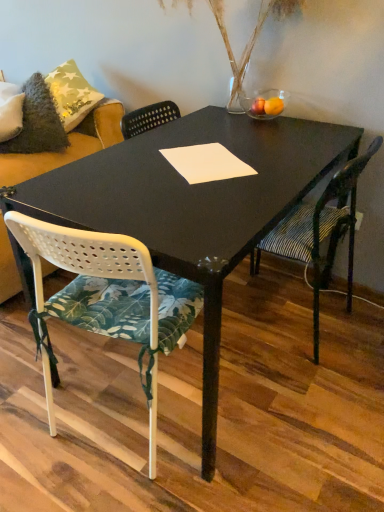
Locate an element on the screen. The image size is (384, 512). translucent glass vase at upper center is located at coordinates point(251,34).

Identify the location of striped fabric chair at right, the second chair when ordered from left to right. The image size is (384, 512). (321, 232).

What do you see at coordinates (206, 163) in the screenshot?
I see `white paper at center` at bounding box center [206, 163].

In order to face white perforated plastic chair at center, which is counted as the 2th chair, starting from the right, should I rotate leftwards or rightwards?

Rotate your view left by about 8.146°.

You are a GUI agent. You are given a task and a screenshot of the screen. Output one action in this format:
    pyautogui.click(x=<x>, y=<y>)
    Task: Click on the fuzzy gray pillow at upper left
    
    Given the screenshot: What is the action you would take?
    pyautogui.click(x=38, y=122)

Is fuzzy gray pillow at upper left at the back of white perforated plastic chair at center, which is counted as the 2th chair, starting from the right?

No, white perforated plastic chair at center, which is counted as the 2th chair, starting from the right, is not facing the opposite direction of fuzzy gray pillow at upper left.

Does white perforated plastic chair at center, which is the 1th chair from left to right, have a lesser width compared to fuzzy gray pillow at upper left?

In fact, white perforated plastic chair at center, which is the 1th chair from left to right, might be wider than fuzzy gray pillow at upper left.

Considering the sizes of white perforated plastic chair at center, which is counted as the 2th chair, starting from the right, and fuzzy gray pillow at upper left in the image, is white perforated plastic chair at center, which is counted as the 2th chair, starting from the right, bigger or smaller than fuzzy gray pillow at upper left?

Considering their sizes, white perforated plastic chair at center, which is counted as the 2th chair, starting from the right, takes up more space than fuzzy gray pillow at upper left.

From a real-world perspective, between white perforated plastic chair at center, which is the 1th chair from left to right, and fuzzy gray pillow at upper left, who is vertically higher?

fuzzy gray pillow at upper left.

Which of these two, white paper at center or striped fabric chair at right, which appears as the 1th chair when viewed from the right, stands shorter?

white paper at center is shorter.

Is white paper at center outside of striped fabric chair at right, the second chair when ordered from left to right?

Yes, white paper at center is not within striped fabric chair at right, the second chair when ordered from left to right.

Is white paper at center at the left side of striped fabric chair at right, the second chair when ordered from left to right?

Correct, you'll find white paper at center to the left of striped fabric chair at right, the second chair when ordered from left to right.

Which is nearer, (318, 334) or (188, 148)?

The point (188, 148) is more forward.

Is striped fabric chair at right, the second chair when ordered from left to right, in front of or behind white paper at center in the image?

striped fabric chair at right, the second chair when ordered from left to right, is positioned closer to the viewer than white paper at center.

Looking at this image, is striped fabric chair at right, the second chair when ordered from left to right, aimed at white paper at center?

No, striped fabric chair at right, the second chair when ordered from left to right, is not facing towards white paper at center.

How many degrees apart are the facing directions of translucent glass vase at upper center and fuzzy gray pillow at upper left?

There is a 29.1-degree angle between the facing directions of translucent glass vase at upper center and fuzzy gray pillow at upper left.

Can you see translucent glass vase at upper center touching fuzzy gray pillow at upper left?

No, translucent glass vase at upper center is not in contact with fuzzy gray pillow at upper left.

Considering the sizes of objects translucent glass vase at upper center and fuzzy gray pillow at upper left in the image provided, who is taller, translucent glass vase at upper center or fuzzy gray pillow at upper left?

With more height is translucent glass vase at upper center.

Considering the sizes of objects translucent glass vase at upper center and white perforated plastic chair at center, which is the 1th chair from left to right, in the image provided, who is smaller, translucent glass vase at upper center or white perforated plastic chair at center, which is the 1th chair from left to right,?

translucent glass vase at upper center.

Is translucent glass vase at upper center shorter than white perforated plastic chair at center, which is the 1th chair from left to right?

Correct, translucent glass vase at upper center is not as tall as white perforated plastic chair at center, which is the 1th chair from left to right.

Considering the positions of point (262, 1) and point (161, 332), is point (262, 1) closer or farther from the camera than point (161, 332)?

Point (262, 1) is farther from the camera than point (161, 332).

Is point (86, 310) positioned before point (223, 164)?

That is True.

How much distance is there between white perforated plastic chair at center, which is counted as the 2th chair, starting from the right, and white paper at center?

white perforated plastic chair at center, which is counted as the 2th chair, starting from the right, and white paper at center are 16.54 inches apart from each other.

Looking at their sizes, would you say white perforated plastic chair at center, which is the 1th chair from left to right, is wider or thinner than white paper at center?

Clearly, white perforated plastic chair at center, which is the 1th chair from left to right, has more width compared to white paper at center.

Considering the relative sizes of white perforated plastic chair at center, which is counted as the 2th chair, starting from the right, and white paper at center in the image provided, is white perforated plastic chair at center, which is counted as the 2th chair, starting from the right, smaller than white paper at center?

No, white perforated plastic chair at center, which is counted as the 2th chair, starting from the right, is not smaller than white paper at center.

What's the angular difference between translucent glass vase at upper center and striped fabric chair at right, the second chair when ordered from left to right,'s facing directions?

They differ by 87.9 degrees in their facing directions.

Looking at the image, does translucent glass vase at upper center seem bigger or smaller compared to striped fabric chair at right, the second chair when ordered from left to right?

Clearly, translucent glass vase at upper center is smaller in size than striped fabric chair at right, the second chair when ordered from left to right.

Which point is more distant from viewer, [272,7] or [283,229]?

The point [272,7] is more distant.

Does translucent glass vase at upper center appear on the right side of striped fabric chair at right, which appears as the 1th chair when viewed from the right?

No.

This screenshot has height=512, width=384. Find the location of `pillow above the white perforated plastic chair at center, which is counted as the 2th chair, starting from the right (from a real-world perspective)`. pillow above the white perforated plastic chair at center, which is counted as the 2th chair, starting from the right (from a real-world perspective) is located at coordinates (x=38, y=122).

Identify the location of notepad behind the striped fabric chair at right, the second chair when ordered from left to right. (206, 163).

Estimate the real-world distances between objects in this image. Which object is closer to translucent glass vase at upper center, white perforated plastic chair at center, which is the 1th chair from left to right, or white paper at center?

Based on the image, white paper at center appears to be nearer to translucent glass vase at upper center.

Which object lies further to the anchor point striped fabric chair at right, which appears as the 1th chair when viewed from the right, white perforated plastic chair at center, which is the 1th chair from left to right, or white paper at center?

white perforated plastic chair at center, which is the 1th chair from left to right, lies further to striped fabric chair at right, which appears as the 1th chair when viewed from the right, than the other object.

Considering their positions, is striped fabric chair at right, the second chair when ordered from left to right, positioned closer to white paper at center than translucent glass vase at upper center?

striped fabric chair at right, the second chair when ordered from left to right, is closer to white paper at center.

Considering their positions, is striped fabric chair at right, the second chair when ordered from left to right, positioned closer to white paper at center than fuzzy gray pillow at upper left?

Among the two, striped fabric chair at right, the second chair when ordered from left to right, is located nearer to white paper at center.

Considering their positions, is striped fabric chair at right, which appears as the 1th chair when viewed from the right, positioned closer to translucent glass vase at upper center than white paper at center?

white paper at center lies closer to translucent glass vase at upper center than the other object.

From the image, which object appears to be farther from fuzzy gray pillow at upper left, white paper at center or white perforated plastic chair at center, which is counted as the 2th chair, starting from the right?

The object further to fuzzy gray pillow at upper left is white perforated plastic chair at center, which is counted as the 2th chair, starting from the right.

In the scene shown: Based on their spatial positions, is white paper at center or white perforated plastic chair at center, which is the 1th chair from left to right, further from translucent glass vase at upper center?

The object further to translucent glass vase at upper center is white perforated plastic chair at center, which is the 1th chair from left to right.

Which object lies nearer to the anchor point translucent glass vase at upper center, striped fabric chair at right, the second chair when ordered from left to right, or white perforated plastic chair at center, which is the 1th chair from left to right?

Based on the image, striped fabric chair at right, the second chair when ordered from left to right, appears to be nearer to translucent glass vase at upper center.

This screenshot has height=512, width=384. Identify the location of plant located between fuzzy gray pillow at upper left and striped fabric chair at right, the second chair when ordered from left to right, in the left-right direction. (251, 34).

This screenshot has height=512, width=384. What are the coordinates of `notepad between white perforated plastic chair at center, which is counted as the 2th chair, starting from the right, and striped fabric chair at right, the second chair when ordered from left to right, in the horizontal direction` in the screenshot? It's located at (206, 163).

Locate an element on the screen. chair between fuzzy gray pillow at upper left and striped fabric chair at right, which appears as the 1th chair when viewed from the right, in the horizontal direction is located at coordinates (107, 298).

This screenshot has width=384, height=512. Find the location of `notepad between translucent glass vase at upper center and striped fabric chair at right, which appears as the 1th chair when viewed from the right, in the up-down direction`. notepad between translucent glass vase at upper center and striped fabric chair at right, which appears as the 1th chair when viewed from the right, in the up-down direction is located at coordinates (206, 163).